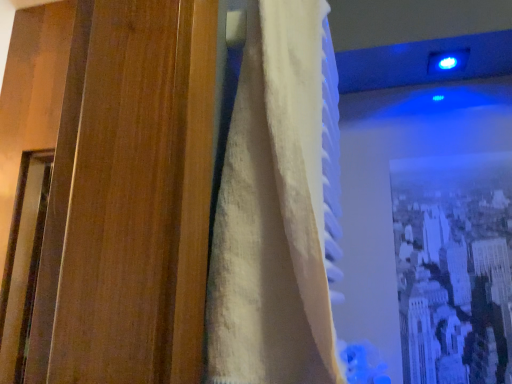
What do you see at coordinates (272, 212) in the screenshot? The height and width of the screenshot is (384, 512). I see `white textured curtain at center` at bounding box center [272, 212].

Where is `white textured curtain at center`? This screenshot has height=384, width=512. white textured curtain at center is located at coordinates (272, 212).

Find the location of a particular element. The image size is (512, 384). white textured curtain at center is located at coordinates (272, 212).